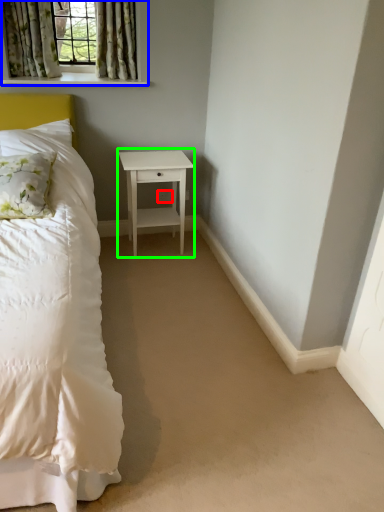
Question: Which is nearer to the electric outlet (highlighted by a red box)? window (highlighted by a blue box) or nightstand (highlighted by a green box).

Choices:
 (A) window
 (B) nightstand

Answer: (B)